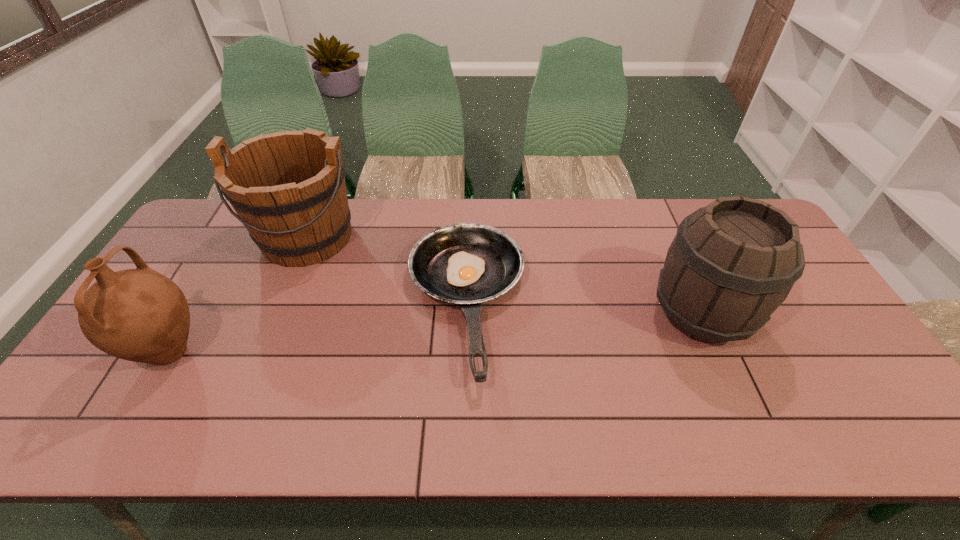
Where is `free location that satisfies the following two spatial constraints: 1. on the side of the shortest object with the handle for carrying; 2. on the left side of the left wine bucket`? free location that satisfies the following two spatial constraints: 1. on the side of the shortest object with the handle for carrying; 2. on the left side of the left wine bucket is located at coordinates (280, 303).